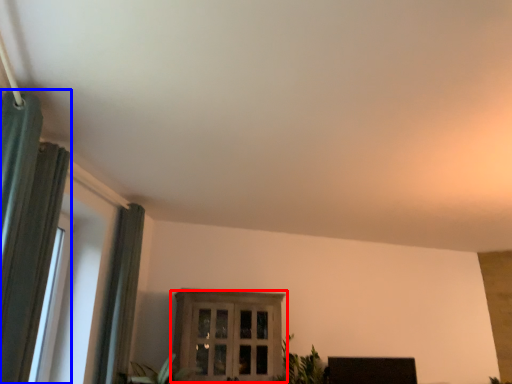
Question: Which point is closer to the camera, window (highlighted by a red box) or curtain (highlighted by a blue box)?

Choices:
 (A) window
 (B) curtain

Answer: (B)